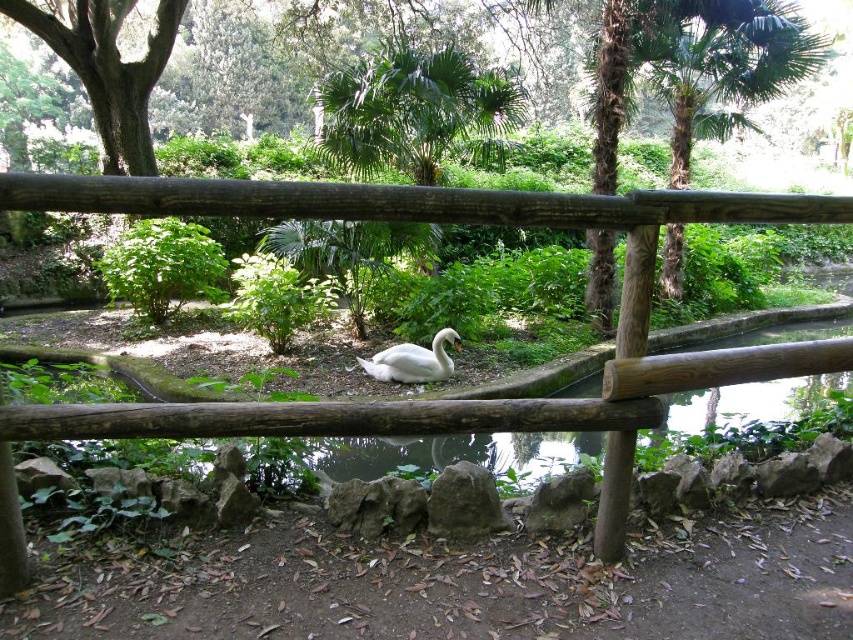
Is wooden fence at center to the right of green leafy tree at center from the viewer's perspective?

Correct, you'll find wooden fence at center to the right of green leafy tree at center.

Is point (257, 196) more distant than point (419, 196)?

No, it is in front of (419, 196).

Find the location of `wooden fence at center`. wooden fence at center is located at coordinates (428, 400).

In the scene shown: Can you confirm if wooden fence at center is shorter than white glossy swan at center?

No, wooden fence at center is not shorter than white glossy swan at center.

Which is behind, point (634, 413) or point (395, 362)?

Positioned behind is point (395, 362).

Where is `wooden fence at center`? wooden fence at center is located at coordinates (428, 400).

Which of these two, green leafy tree at center or white glossy swan at center, stands taller?

Standing taller between the two is green leafy tree at center.

Between green leafy tree at center and white glossy swan at center, which one is positioned lower?

white glossy swan at center

Describe the element at coordinates (483, 189) in the screenshot. The width and height of the screenshot is (853, 640). I see `green leafy tree at center` at that location.

Locate an element on the screen. This screenshot has height=640, width=853. green leafy tree at center is located at coordinates (483, 189).